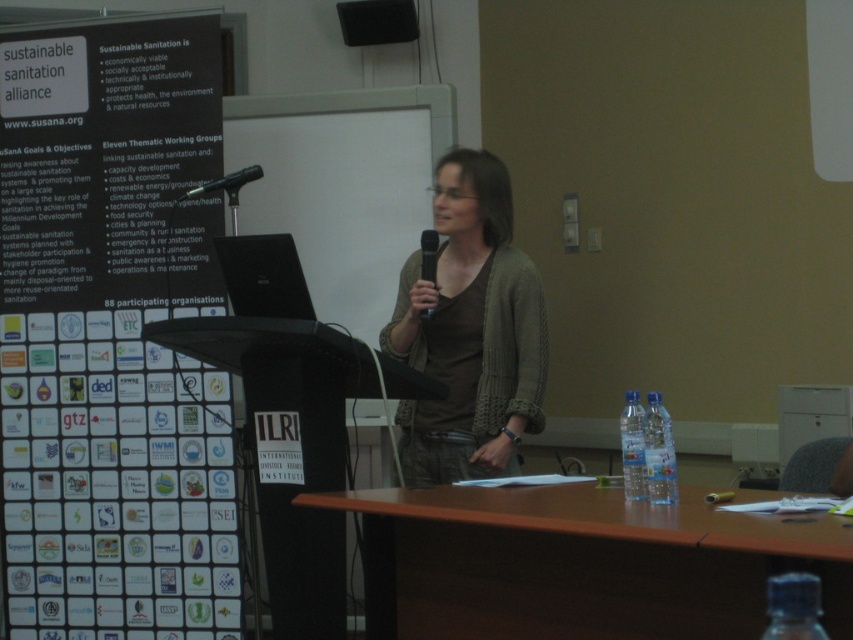
Can you confirm if white paperboard at upper left is taller than clear plastic bottle at table right?

Correct, white paperboard at upper left is much taller as clear plastic bottle at table right.

Is white paperboard at upper left shorter than clear plastic bottle at table right?

Incorrect, white paperboard at upper left's height does not fall short of clear plastic bottle at table right's.

Is point (114, 346) in front of point (633, 442)?

That is False.

Where is `white paperboard at upper left`? This screenshot has height=640, width=853. white paperboard at upper left is located at coordinates (111, 336).

Identify the location of matte black speaker at upper center. (376, 20).

Between point (392, 38) and point (241, 182), which one is positioned in front?

Point (241, 182)

You are a GUI agent. You are given a task and a screenshot of the screen. Output one action in this format:
    pyautogui.click(x=<x>, y=<y>)
    Task: Click on the matte black speaker at upper center
    
    Given the screenshot: What is the action you would take?
    pyautogui.click(x=376, y=20)

Is point (36, 260) positioned after point (432, 236)?

Yes, it is.

Which of these two, white paperboard at upper left or black plastic microphone at center, stands shorter?

black plastic microphone at center is shorter.

Is point (125, 102) behind point (430, 243)?

Yes, it is.

Find the location of a particular element. The width and height of the screenshot is (853, 640). white paperboard at upper left is located at coordinates (111, 336).